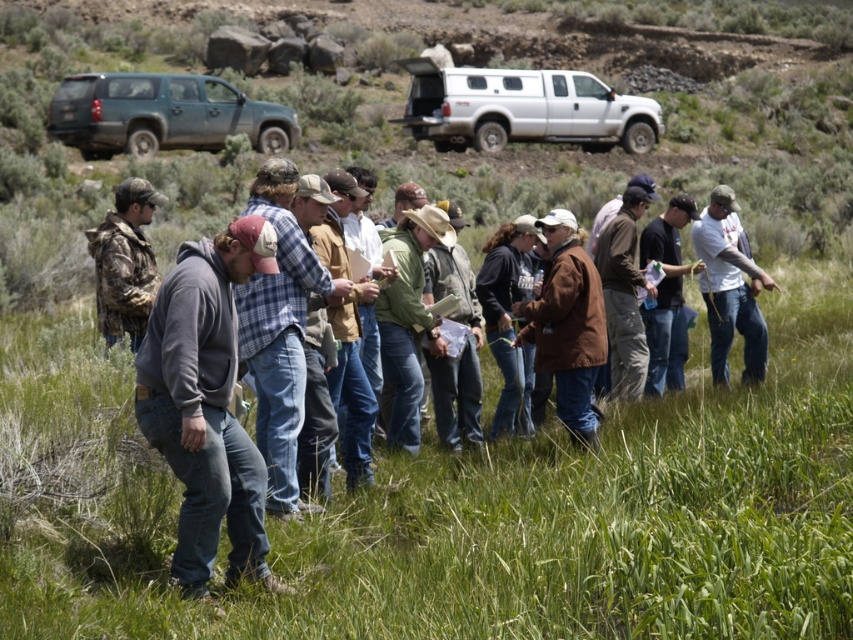
Question: Is gray fleece jacket at center thinner than teal matte suv at upper left?

Choices:
 (A) yes
 (B) no

Answer: (B)

Question: Which object is closer to the camera taking this photo?

Choices:
 (A) white t-shirt at center
 (B) brown corduroy jacket at center
 (C) blue plaid shirt at center
 (D) denim jeans at center

Answer: (D)

Question: Which point is farther to the camera?

Choices:
 (A) teal matte suv at upper left
 (B) brown leather jacket at center
 (C) gray fleece jacket at center
 (D) denim jeans at center

Answer: (A)

Question: Does white t-shirt at center appear over camo jacket at left?

Choices:
 (A) yes
 (B) no

Answer: (B)

Question: Does teal matte suv at upper left have a lesser width compared to brown corduroy jacket at center?

Choices:
 (A) yes
 (B) no

Answer: (A)

Question: Among these points, which one is farthest from the camera?

Choices:
 (A) (509, 86)
 (B) (490, 452)
 (C) (641, 362)
 (D) (119, 321)

Answer: (A)